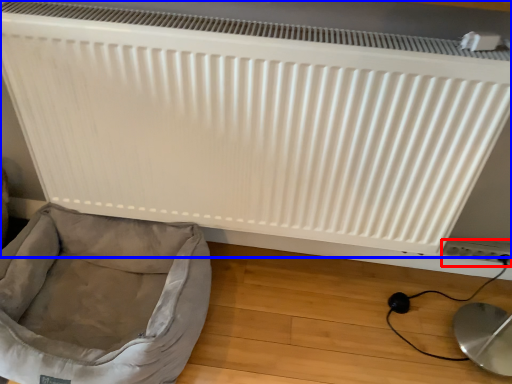
Question: Which object appears closest to the camera in this image, electric outlet (highlighted by a red box) or radiator (highlighted by a blue box)?

Choices:
 (A) electric outlet
 (B) radiator

Answer: (B)